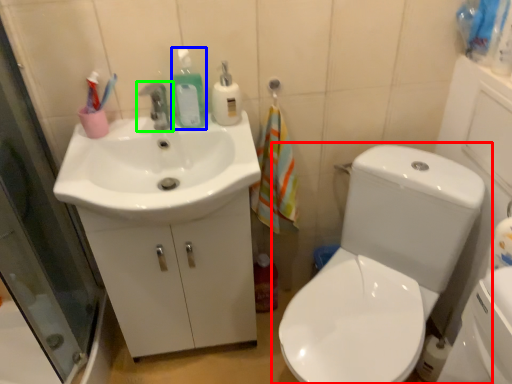
Question: Which object is the farthest from toilet (highlighted by a red box)? Choose among these: cleaning product (highlighted by a blue box) or tap (highlighted by a green box).

Choices:
 (A) cleaning product
 (B) tap

Answer: (B)